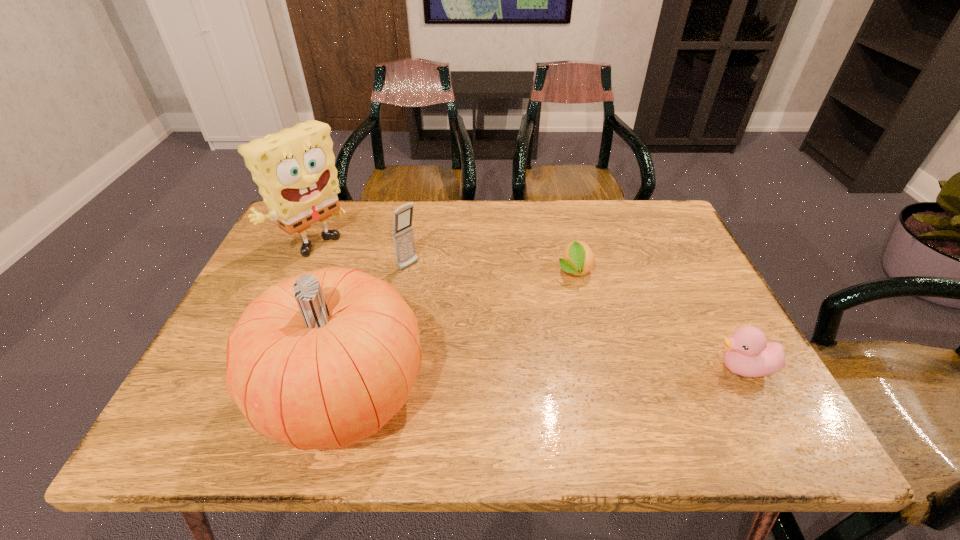
Locate an element on the screen. free spot that satisfies the following two spatial constraints: 1. on the front side of the pumpkin; 2. on the front-facing side of the sponge is located at coordinates (250, 394).